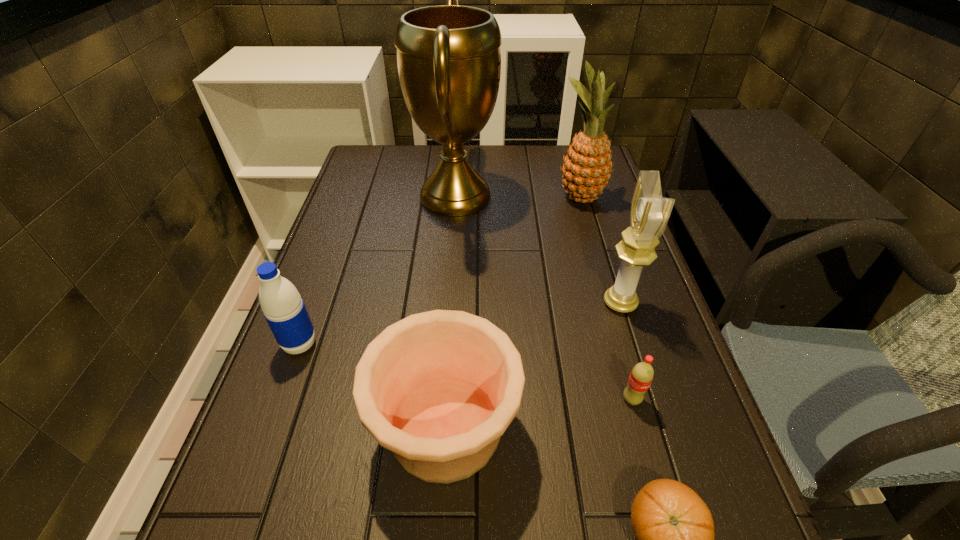
Image resolution: width=960 pixels, height=540 pixels. What are the coordinates of `free spot that satisfies the following two spatial constraints: 1. on the surface of the trophy cup with symbols; 2. on the left side of the pottery` in the screenshot? It's located at (439, 428).

The height and width of the screenshot is (540, 960). In order to click on free spot that satisfies the following two spatial constraints: 1. on the surface of the third shortest object with symbols; 2. on the left side of the tallest object in this screenshot , I will do `click(439, 428)`.

Find the location of a particular element. free spot that satisfies the following two spatial constraints: 1. on the surface of the trophy cup with symbols; 2. on the left side of the soda is located at coordinates (441, 399).